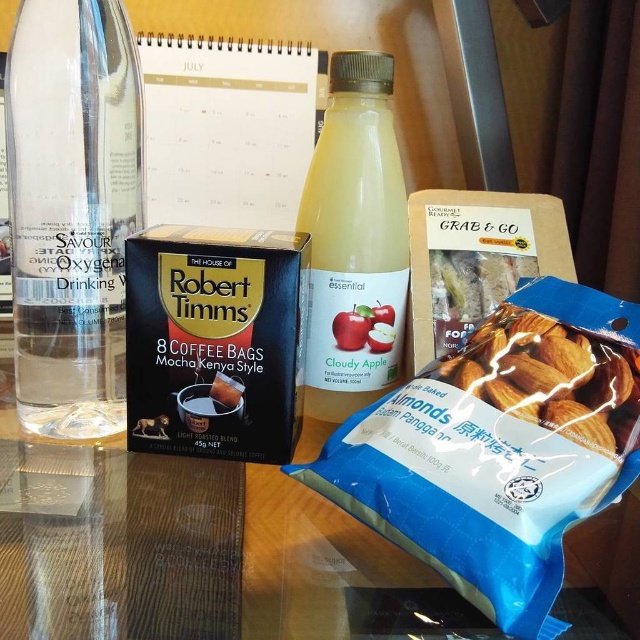
Question: Does cloudy apple juice at center have a greater width compared to smooth almond at lower right?

Choices:
 (A) yes
 (B) no

Answer: (B)

Question: Estimate the real-world distances between objects in this image. Which object is farther from the smooth almond at lower right?

Choices:
 (A) clear glass bottle at left
 (B) cloudy apple juice at center

Answer: (A)

Question: Can you confirm if cloudy apple juice at center is positioned to the right of smooth almond at lower right?

Choices:
 (A) no
 (B) yes

Answer: (A)

Question: Can you confirm if clear glass bottle at left is bigger than cloudy apple juice at center?

Choices:
 (A) no
 (B) yes

Answer: (B)

Question: Which is farther from the cloudy apple juice at center?

Choices:
 (A) smooth almond at lower right
 (B) clear glass bottle at left

Answer: (B)

Question: Estimate the real-world distances between objects in this image. Which object is farther from the smooth almond at lower right?

Choices:
 (A) cloudy apple juice at center
 (B) clear glass bottle at left

Answer: (B)